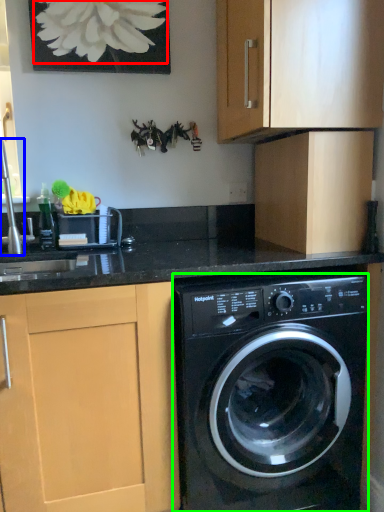
Question: Based on their relative distances, which object is nearer to flower (highlighted by a red box)? Choose from faucet (highlighted by a blue box) and washing machine (highlighted by a green box).

Choices:
 (A) faucet
 (B) washing machine

Answer: (A)